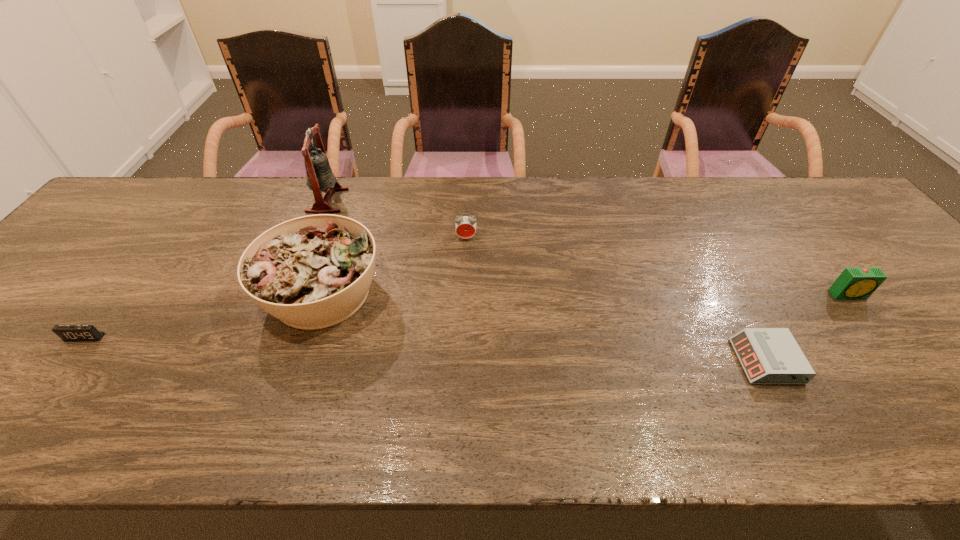
The height and width of the screenshot is (540, 960). I want to click on vacant space located on the front of the salad, so click(x=274, y=439).

Where is `vacant region located 0.140m on the face of the farthest alarm clock`? vacant region located 0.140m on the face of the farthest alarm clock is located at coordinates (465, 279).

Locate an element on the screen. This screenshot has height=540, width=960. free space located 0.150m on the front-facing side of the third nearest alarm clock is located at coordinates (893, 352).

At what (x,y) coordinates should I click in order to perform the action: click on free space located 0.220m on the back of the second object from right to left. Please return your answer as a coordinate pair (x, y). The height and width of the screenshot is (540, 960). Looking at the image, I should click on 718,270.

Locate an element on the screen. The image size is (960, 540). vacant space situated 0.190m on the front-facing side of the leftmost alarm clock is located at coordinates (20, 421).

Identify the location of object that is at the far edge. Image resolution: width=960 pixels, height=540 pixels. (320, 177).

This screenshot has height=540, width=960. I want to click on vacant area at the far edge of the desktop, so click(x=735, y=192).

Image resolution: width=960 pixels, height=540 pixels. In the image, there is a desktop. Find the location of `free region at the near edge`. free region at the near edge is located at coordinates (516, 417).

The height and width of the screenshot is (540, 960). Find the location of `free point at the left edge`. free point at the left edge is located at coordinates (4, 354).

Identify the location of free space at the right edge of the desktop. The width and height of the screenshot is (960, 540). (887, 289).